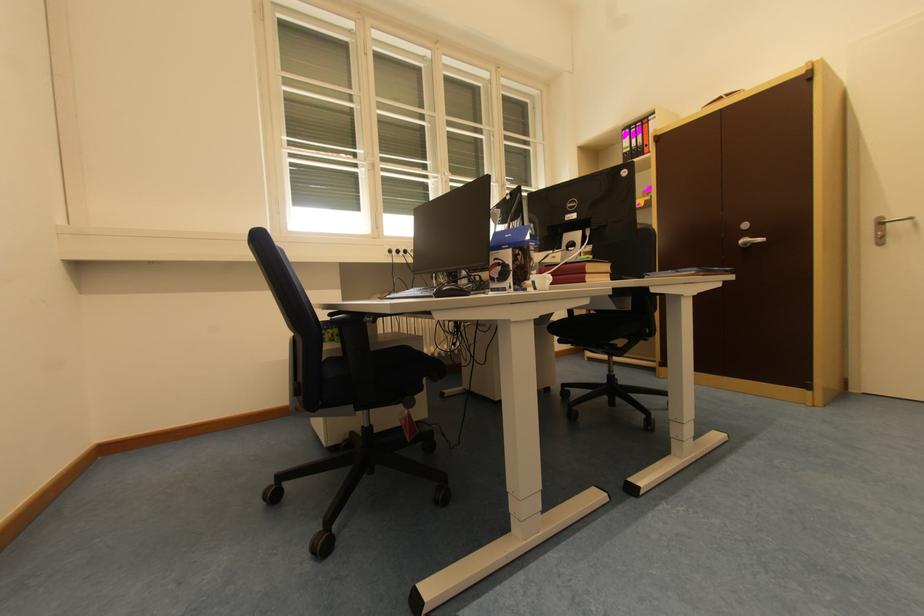
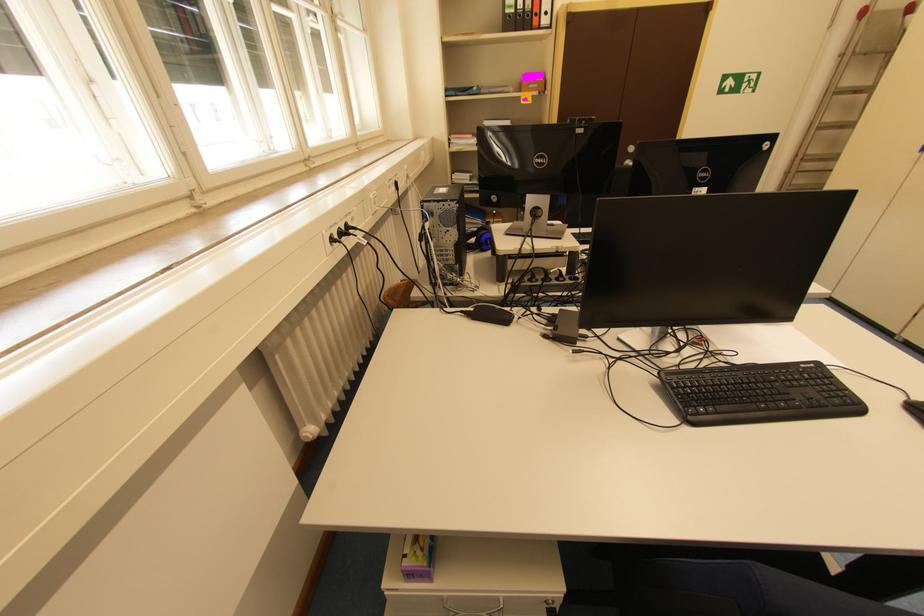
Find the pixel in the second image that matches point (652, 153) in the first image.

(541, 25)